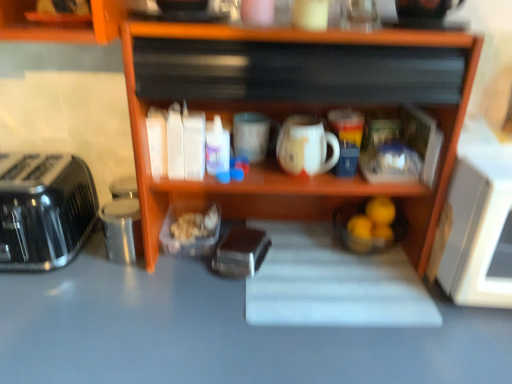
Question: Is white matte mug at center outside of white glossy mug at center?

Choices:
 (A) yes
 (B) no

Answer: (A)

Question: Is white matte mug at center looking in the opposite direction of white glossy mug at center?

Choices:
 (A) yes
 (B) no

Answer: (B)

Question: Can you confirm if white matte mug at center is taller than white glossy mug at center?

Choices:
 (A) no
 (B) yes

Answer: (A)

Question: Can you confirm if white matte mug at center is bigger than white glossy mug at center?

Choices:
 (A) yes
 (B) no

Answer: (B)

Question: Would you consider white matte mug at center to be distant from white glossy mug at center?

Choices:
 (A) no
 (B) yes

Answer: (A)

Question: From the image's perspective, is white matte mug at center located above white glossy mug at center?

Choices:
 (A) no
 (B) yes

Answer: (B)

Question: Could metallic silver toaster at center be considered to be inside brushed metal toaster at left?

Choices:
 (A) yes
 (B) no

Answer: (B)

Question: Is brushed metal toaster at left in contact with metallic silver toaster at center?

Choices:
 (A) no
 (B) yes

Answer: (A)

Question: Does brushed metal toaster at left have a larger size compared to metallic silver toaster at center?

Choices:
 (A) yes
 (B) no

Answer: (A)

Question: Is brushed metal toaster at left further to the viewer compared to metallic silver toaster at center?

Choices:
 (A) yes
 (B) no

Answer: (B)

Question: Is brushed metal toaster at left smaller than metallic silver toaster at center?

Choices:
 (A) no
 (B) yes

Answer: (A)

Question: From the image's perspective, is brushed metal toaster at left below metallic silver toaster at center?

Choices:
 (A) yes
 (B) no

Answer: (B)

Question: Are white glossy mug at center and metallic silver toaster at center located far from each other?

Choices:
 (A) yes
 (B) no

Answer: (B)